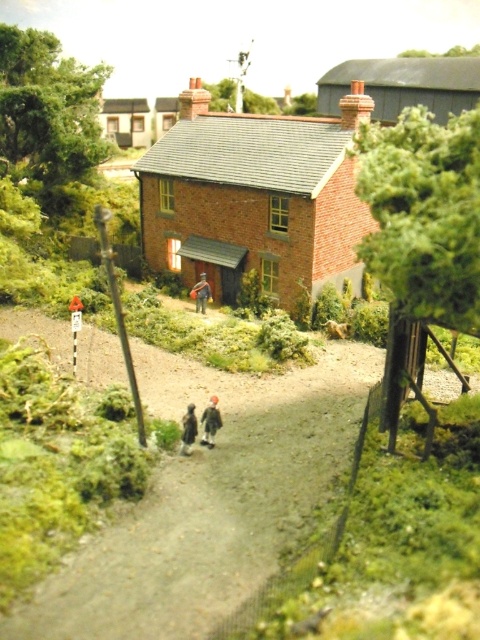
Is brown woolen coat at center taller than dark brown leather jacket at center?

Correct, brown woolen coat at center is much taller as dark brown leather jacket at center.

Who is higher up, brown woolen coat at center or dark brown leather jacket at center?

brown woolen coat at center

Is point (211, 416) in front of point (191, 444)?

No.

Identify the location of brown woolen coat at center. This screenshot has width=480, height=640. (211, 420).

Consider the image. Can you confirm if brown woolen coat at center is positioned to the left of smooth brown figure at center?

Incorrect, brown woolen coat at center is not on the left side of smooth brown figure at center.

I want to click on brown woolen coat at center, so click(x=211, y=420).

Based on the photo, who is more forward, (192, 404) or (204, 304)?

Point (192, 404)

Does dark brown leather jacket at center appear over smooth brown figure at center?

Actually, dark brown leather jacket at center is below smooth brown figure at center.

Image resolution: width=480 pixels, height=640 pixels. In order to click on dark brown leather jacket at center in this screenshot , I will do `click(188, 429)`.